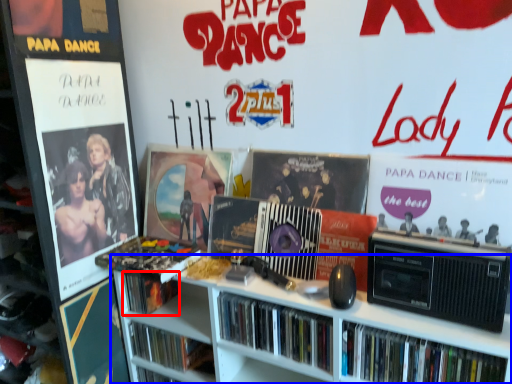
Question: Which object appears closest to the camera in this image, book (highlighted by a red box) or bookcase (highlighted by a blue box)?

Choices:
 (A) book
 (B) bookcase

Answer: (B)